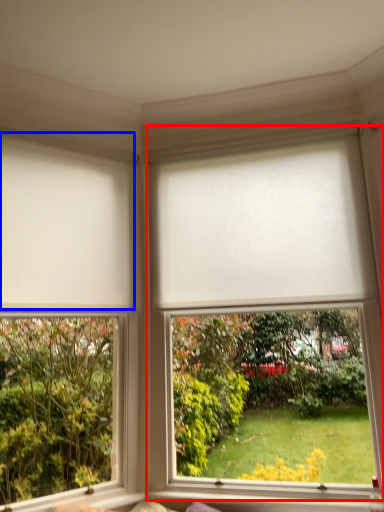
Question: Which point is closer to the camera, window (highlighted by a red box) or blind (highlighted by a blue box)?

Choices:
 (A) window
 (B) blind

Answer: (A)